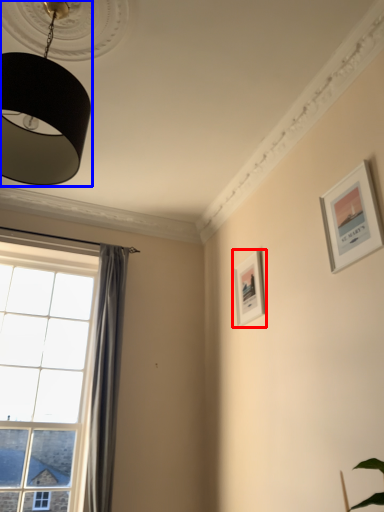
Question: Which point is further to the camera, picture frame (highlighted by a red box) or lamp (highlighted by a blue box)?

Choices:
 (A) picture frame
 (B) lamp

Answer: (A)